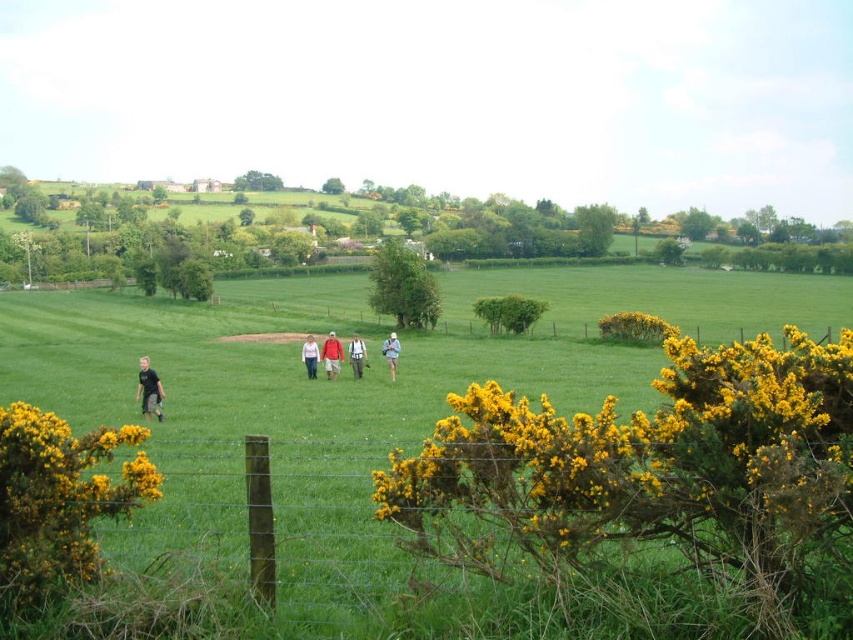
Question: Which point is farther to the camera?

Choices:
 (A) blue fabric backpack at center
 (B) white cotton shirt at center
 (C) light brown hair at lower left

Answer: (B)

Question: Can you confirm if light brown hair at lower left is positioned above white cotton shirt at center?

Choices:
 (A) yes
 (B) no

Answer: (B)

Question: Does yellow bush at center appear over matte white shirt at center?

Choices:
 (A) no
 (B) yes

Answer: (A)

Question: Which object is closer to the camera taking this photo?

Choices:
 (A) green grassy field at center
 (B) yellow bush at center
 (C) light brown hair at lower left
 (D) yellow flowering bush at lower left

Answer: (B)

Question: Does yellow flowering bush at lower left lie behind light brown hair at lower left?

Choices:
 (A) yes
 (B) no

Answer: (B)

Question: Estimate the real-world distances between objects in this image. Which object is closer to the red shirt at center?

Choices:
 (A) yellow bush at center
 (B) light brown hair at lower left

Answer: (B)